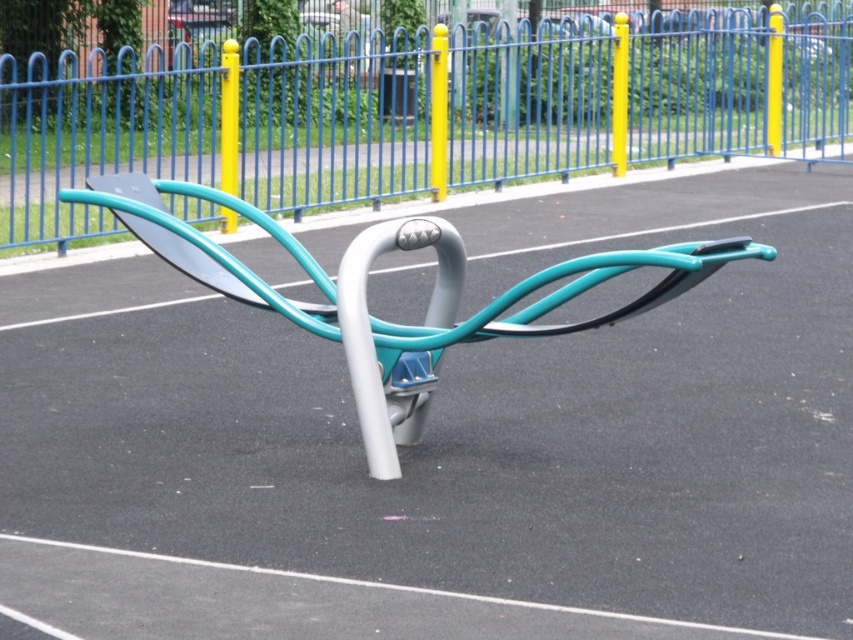
Question: Among these objects, which one is nearest to the camera?

Choices:
 (A) yellow matte pole at center
 (B) blue metal fence at upper center
 (C) yellow glossy pole at upper center
 (D) matte yellow pole at upper right

Answer: (B)

Question: Based on their relative distances, which object is farther from the yellow glossy pole at upper center?

Choices:
 (A) blue metal fence at upper center
 (B) matte yellow pole at upper right
 (C) yellow matte pole at upper right

Answer: (C)

Question: From the image, what is the correct spatial relationship of yellow glossy pole at upper center in relation to matte yellow pole at upper right?

Choices:
 (A) below
 (B) above

Answer: (A)

Question: Which point is closer to the camera?

Choices:
 (A) yellow matte pole at center
 (B) yellow matte pole at upper right

Answer: (A)

Question: Does blue metal fence at upper center lie in front of matte yellow pole at upper right?

Choices:
 (A) no
 (B) yes

Answer: (B)

Question: Can you confirm if yellow matte pole at center is positioned below yellow matte pole at upper right?

Choices:
 (A) no
 (B) yes

Answer: (B)